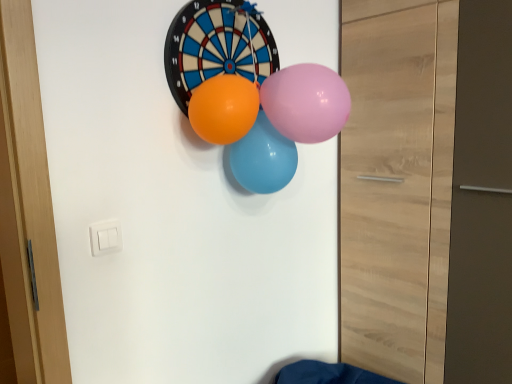
Question: From a real-world perspective, is pink glossy balloon at center, the 1th balloon in the front-to-back sequence, on matte blue balloon at center, acting as the 3th balloon starting from the front?

Choices:
 (A) yes
 (B) no

Answer: (A)

Question: Is pink glossy balloon at center, the third balloon in the back-to-front sequence, smaller than matte blue balloon at center, acting as the 3th balloon starting from the front?

Choices:
 (A) yes
 (B) no

Answer: (A)

Question: Would you say pink glossy balloon at center, the 1th balloon in the front-to-back sequence, contains matte blue balloon at center, which appears as the 1th balloon when viewed from the back?

Choices:
 (A) yes
 (B) no

Answer: (B)

Question: Is pink glossy balloon at center, the 1th balloon in the front-to-back sequence, directly adjacent to matte blue balloon at center, acting as the 3th balloon starting from the front?

Choices:
 (A) no
 (B) yes

Answer: (A)

Question: From a real-world perspective, is pink glossy balloon at center, the 1th balloon in the front-to-back sequence, positioned under matte blue balloon at center, acting as the 3th balloon starting from the front, based on gravity?

Choices:
 (A) yes
 (B) no

Answer: (B)

Question: Does pink glossy balloon at center, the 1th balloon in the front-to-back sequence, appear on the right side of matte blue balloon at center, acting as the 3th balloon starting from the front?

Choices:
 (A) no
 (B) yes

Answer: (B)

Question: Is matte blue balloon at center, acting as the 3th balloon starting from the front, to the left of orange rubber balloon at center, the 2th balloon viewed from the back, from the viewer's perspective?

Choices:
 (A) yes
 (B) no

Answer: (B)

Question: From the image's perspective, is matte blue balloon at center, acting as the 3th balloon starting from the front, located above orange rubber balloon at center, which is counted as the second balloon, starting from the front?

Choices:
 (A) yes
 (B) no

Answer: (B)

Question: Is orange rubber balloon at center, the 2th balloon viewed from the back, at the back of matte blue balloon at center, acting as the 3th balloon starting from the front?

Choices:
 (A) no
 (B) yes

Answer: (A)

Question: Is matte blue balloon at center, acting as the 3th balloon starting from the front, not inside orange rubber balloon at center, the 2th balloon viewed from the back?

Choices:
 (A) no
 (B) yes

Answer: (B)

Question: Does matte blue balloon at center, acting as the 3th balloon starting from the front, touch orange rubber balloon at center, which is counted as the second balloon, starting from the front?

Choices:
 (A) yes
 (B) no

Answer: (B)

Question: Would you consider matte blue balloon at center, which appears as the 1th balloon when viewed from the back, to be distant from orange rubber balloon at center, the 2th balloon viewed from the back?

Choices:
 (A) no
 (B) yes

Answer: (A)

Question: From the image's perspective, does pink glossy balloon at center, the third balloon in the back-to-front sequence, appear higher than orange rubber balloon at center, which is counted as the second balloon, starting from the front?

Choices:
 (A) yes
 (B) no

Answer: (A)